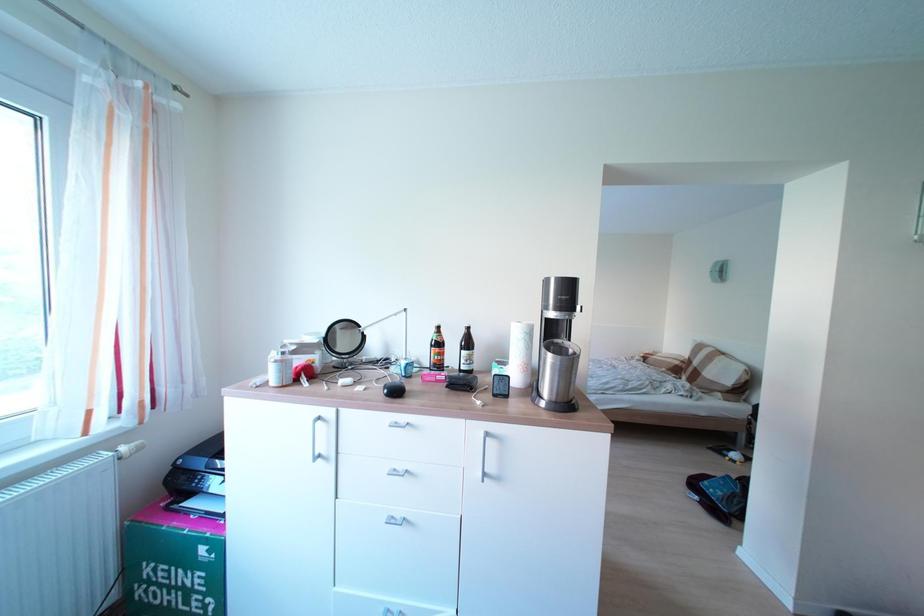
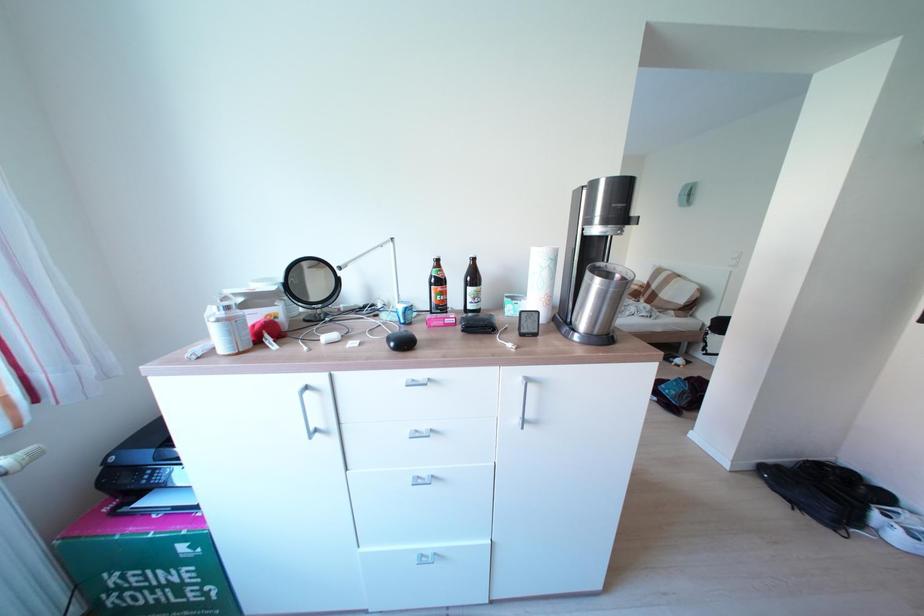
Question: The first image is from the beginning of the video and the second image is from the end. How did the camera likely rotate when shooting the video?

Choices:
 (A) Left
 (B) Right
 (C) Up
 (D) Down

Answer: (D)